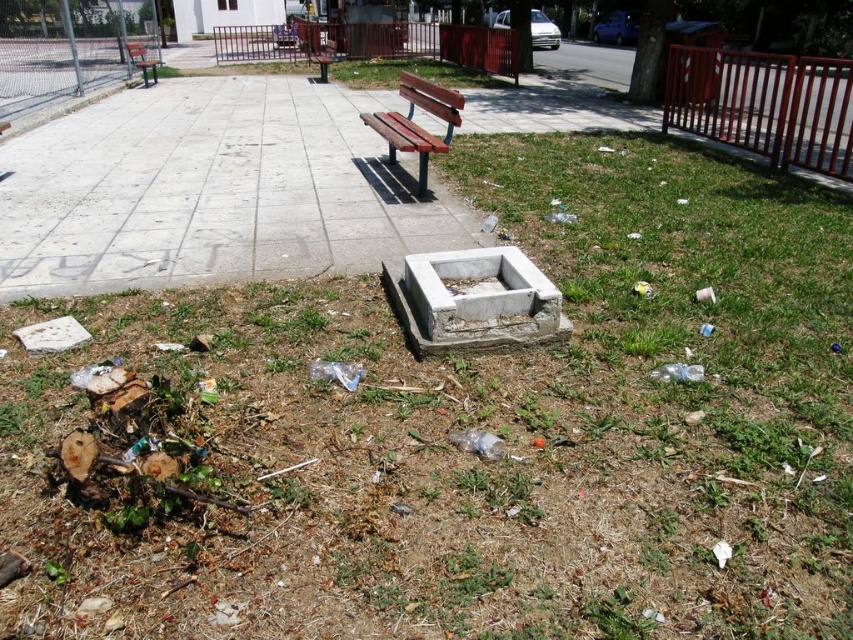
You are a park visitor who wants to sit comfortably. You see two wooden benches in the park. The wooden bench at center and the wooden bench at upper left. Which bench is taller and thus might provide a better view?

The wooden bench at center is taller than the wooden bench at upper left, so it might provide a better view.

You are standing at the point marked as point (x=212, y=189) in the park. What is the object located exactly at this point?

The object located exactly at point (x=212, y=189) is the concrete pavement at center.

You are standing at the center of the park and see two points marked in the image. Which point is closer to you, point (250,227) or point (421,150)?

Point (250,227) is closer to you because it is in front of point (421,150).